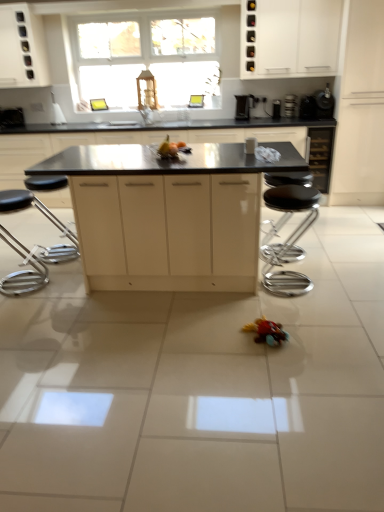
Question: Is yellow matte fruit at center bigger than matte yellow fruit at center, which is counted as the second toy, starting from the front?

Choices:
 (A) no
 (B) yes

Answer: (A)

Question: Is yellow matte fruit at center facing towards matte yellow fruit at center, the 1th toy viewed from the back?

Choices:
 (A) yes
 (B) no

Answer: (B)

Question: From the image's perspective, is yellow matte fruit at center on matte yellow fruit at center, positioned as the first toy in left-to-right order?

Choices:
 (A) yes
 (B) no

Answer: (A)

Question: Is yellow matte fruit at center outside of matte yellow fruit at center, arranged as the 2th toy when viewed from the right?

Choices:
 (A) no
 (B) yes

Answer: (B)

Question: From the image's perspective, is yellow matte fruit at center below matte yellow fruit at center, positioned as the first toy in left-to-right order?

Choices:
 (A) no
 (B) yes

Answer: (A)

Question: In terms of size, does black glossy coffee maker at upper right, which ranks as the first appliance in right-to-left order, appear bigger or smaller than yellow matte fruit at center?

Choices:
 (A) big
 (B) small

Answer: (A)

Question: Do you think black glossy coffee maker at upper right, the first appliance positioned from the front, is within yellow matte fruit at center, or outside of it?

Choices:
 (A) inside
 (B) outside

Answer: (B)

Question: From the image's perspective, is black glossy coffee maker at upper right, the third appliance positioned from the left, located above or below yellow matte fruit at center?

Choices:
 (A) below
 (B) above

Answer: (B)

Question: From their relative heights in the image, would you say black glossy coffee maker at upper right, the third appliance positioned from the left, is taller or shorter than yellow matte fruit at center?

Choices:
 (A) tall
 (B) short

Answer: (A)

Question: In the image, is black matte island at center, which appears as the 2th cabinetry when viewed from the left, positioned in front of or behind polished chrome bar stool at right, which appears as the second bar stool when viewed from the left?

Choices:
 (A) front
 (B) behind

Answer: (B)

Question: From a real-world perspective, relative to polished chrome bar stool at right, which is the first bar stool in right-to-left order, is black matte island at center, positioned as the fifth cabinetry in right-to-left order, vertically above or below?

Choices:
 (A) below
 (B) above

Answer: (B)

Question: Is black matte island at center, which appears as the 2th cabinetry when viewed from the left, wider or thinner than polished chrome bar stool at right, which is the first bar stool in right-to-left order?

Choices:
 (A) wide
 (B) thin

Answer: (A)

Question: Considering the positions of black matte island at center, positioned as the fifth cabinetry in right-to-left order, and polished chrome bar stool at right, which is the first bar stool in right-to-left order, in the image, is black matte island at center, positioned as the fifth cabinetry in right-to-left order, taller or shorter than polished chrome bar stool at right, which is the first bar stool in right-to-left order,?

Choices:
 (A) short
 (B) tall

Answer: (B)

Question: Does point (329, 89) appear closer or farther from the camera than point (281, 338)?

Choices:
 (A) closer
 (B) farther

Answer: (B)

Question: From the image's perspective, is black glossy coffee maker at upper right, which ranks as the first appliance in right-to-left order, positioned above or below rubberized red toy car at lower center, which ranks as the 2th toy in top-to-bottom order?

Choices:
 (A) below
 (B) above

Answer: (B)